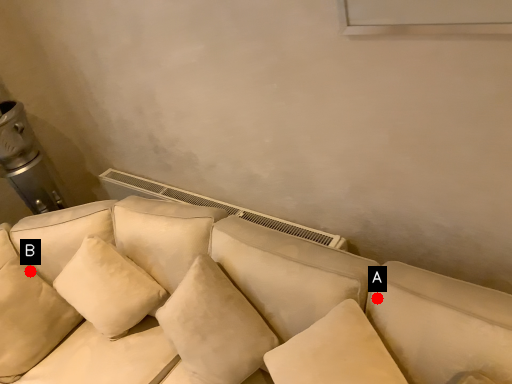
Question: Two points are circled on the image, labeled by A and B beside each circle. Among these points, which one is farthest from the camera?

Choices:
 (A) A is further
 (B) B is further

Answer: (B)